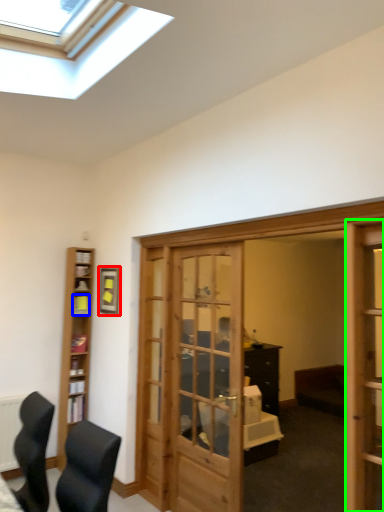
Question: Which is nearer to the picture frame (highlighted by a red box)? shelf (highlighted by a blue box) or screen door (highlighted by a green box).

Choices:
 (A) shelf
 (B) screen door

Answer: (A)